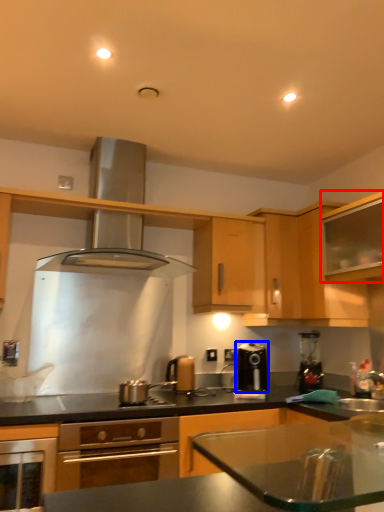
Question: Which object is further to the camera taking this photo, cabinetry (highlighted by a red box) or kitchen appliance (highlighted by a blue box)?

Choices:
 (A) cabinetry
 (B) kitchen appliance

Answer: (B)